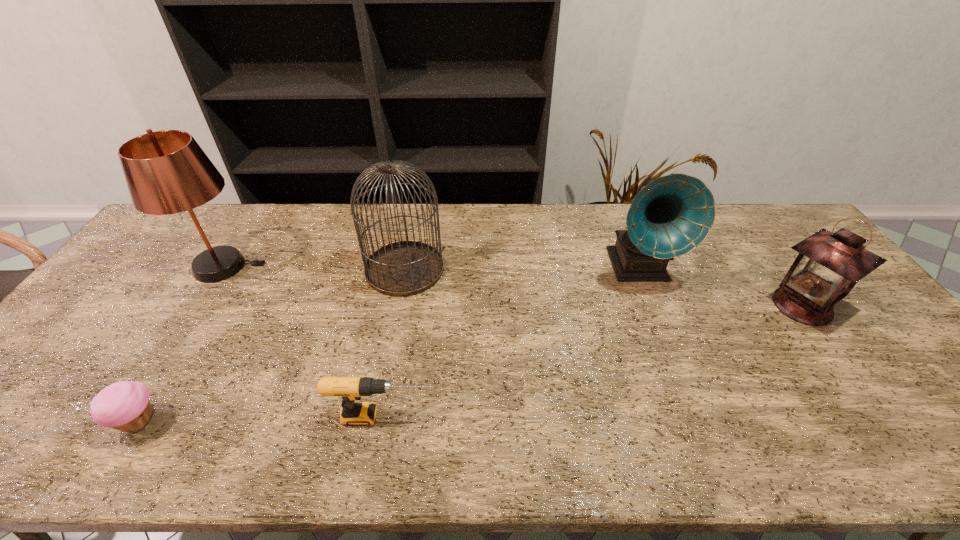
Find the location of a particular element. Image resolution: width=960 pixels, height=540 pixels. free location at the near edge of the desktop is located at coordinates (335, 457).

In the image, there is a desktop. At what (x,y) coordinates should I click in order to perform the action: click on blank space at the left edge. Please return your answer as a coordinate pair (x, y). Looking at the image, I should click on (69, 370).

In the image, there is a desktop. Find the location of `free space at the right edge`. free space at the right edge is located at coordinates (959, 418).

Locate an element on the screen. Image resolution: width=960 pixels, height=540 pixels. vacant space at the far left corner of the desktop is located at coordinates (212, 209).

Find the location of a particular element. The width and height of the screenshot is (960, 540). free space at the near left corner is located at coordinates (52, 430).

This screenshot has width=960, height=540. What are the coordinates of `vacant space at the far right corner of the desktop` in the screenshot? It's located at (744, 219).

In order to click on blank region between the fifth object from left to right and the oil lamp in this screenshot , I will do `click(720, 287)`.

Find the location of a particular element. free space between the birdcage and the fourth tallest object is located at coordinates (604, 288).

Find the location of a particular element. The height and width of the screenshot is (540, 960). vacant area that lies between the oil lamp and the phonograph_record is located at coordinates (720, 287).

In order to click on free area in between the second shortest object and the phonograph_record in this screenshot , I will do `click(511, 342)`.